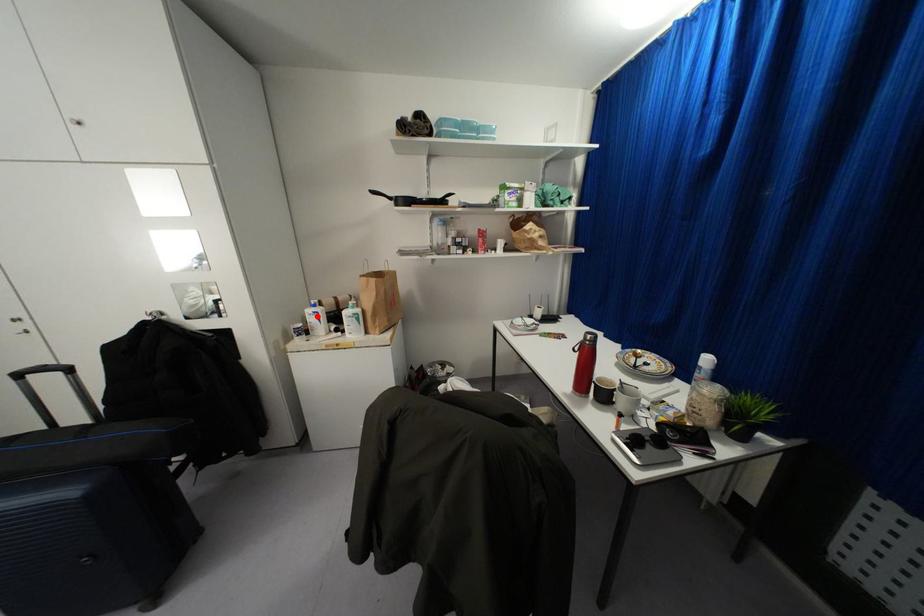
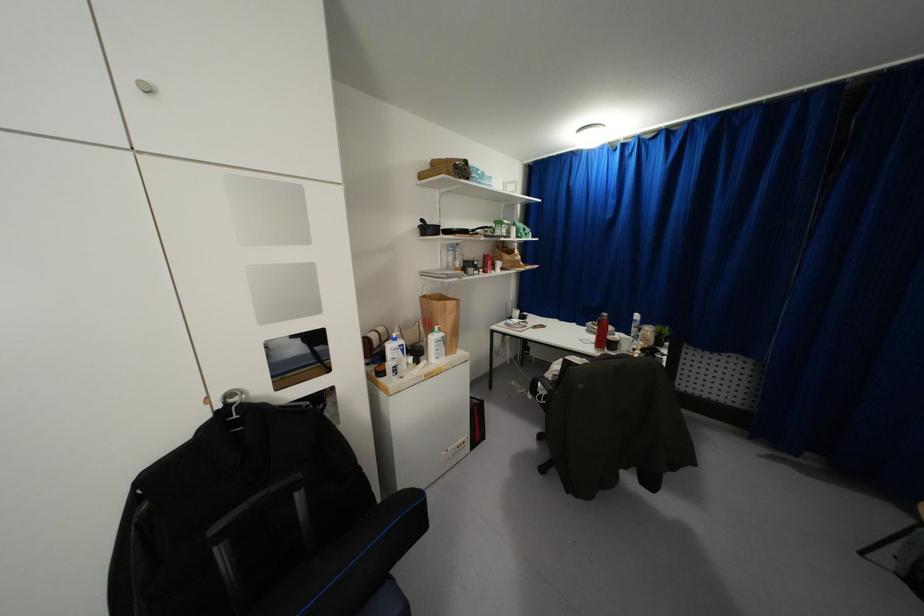
Where in the second image is the point corresponding to the highlighted location from the first image?

(402, 350)